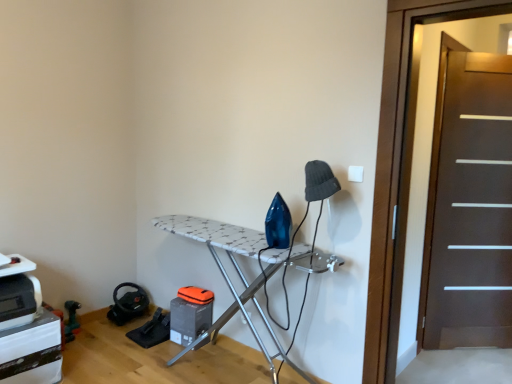
Where is `vacant location below dark brown wood screen door at right, the second screen door from the left (from a real-world perspective)`? vacant location below dark brown wood screen door at right, the second screen door from the left (from a real-world perspective) is located at coordinates (471, 349).